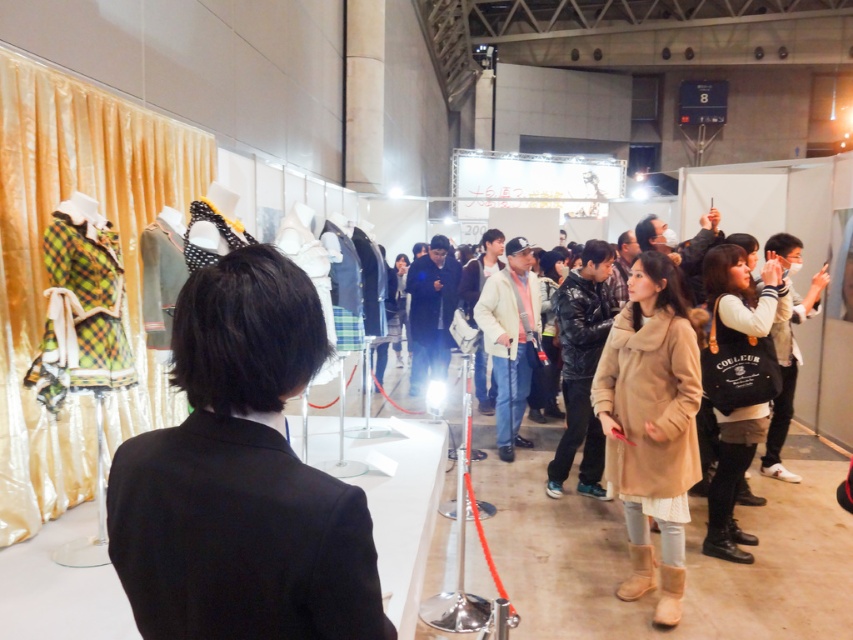
Question: Is black matte blazer at left wider than white fleece jacket at center right?

Choices:
 (A) no
 (B) yes

Answer: (A)

Question: Which point is closer to the camera?

Choices:
 (A) [x=515, y=280]
 (B) [x=619, y=444]
 (C) [x=721, y=468]
 (D) [x=361, y=534]

Answer: (D)

Question: Estimate the real-world distances between objects in this image. Which object is closer to the white fleece jacket at center right?

Choices:
 (A) camel wool coat at center
 (B) black matte blazer at left

Answer: (A)

Question: Where is camel wool coat at center located in relation to light beige jacket at center in the image?

Choices:
 (A) left
 (B) right

Answer: (B)

Question: Which point is closer to the camera?

Choices:
 (A) (654, 461)
 (B) (485, 292)
 (C) (770, 324)

Answer: (A)

Question: Considering the relative positions of black matte blazer at left and camel wool coat at center in the image provided, where is black matte blazer at left located with respect to camel wool coat at center?

Choices:
 (A) above
 (B) below

Answer: (A)